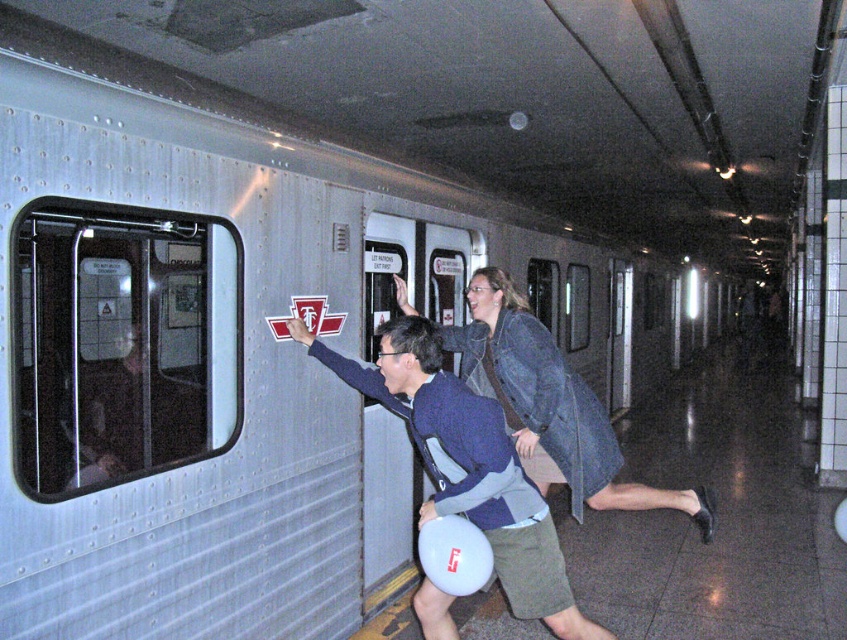
You are a passenger on a moving subway car and need to reach the emergency stop button located 1.2 meters away from your current position. There are two people in front of you, the blue fabric shirt at center and the denim jacket at center. Can you safely step between them to reach the button?

The blue fabric shirt at center and denim jacket at center are 1.14 meters apart. Since the distance between them is less than the 1.2 meters required to reach the button, you cannot safely step between them to cover the necessary distance.

Based on the scene description, which object has a smaller width between the blue fabric shirt at center and the denim jacket at center?

The blue fabric shirt at center has a smaller width compared to the denim jacket at center.